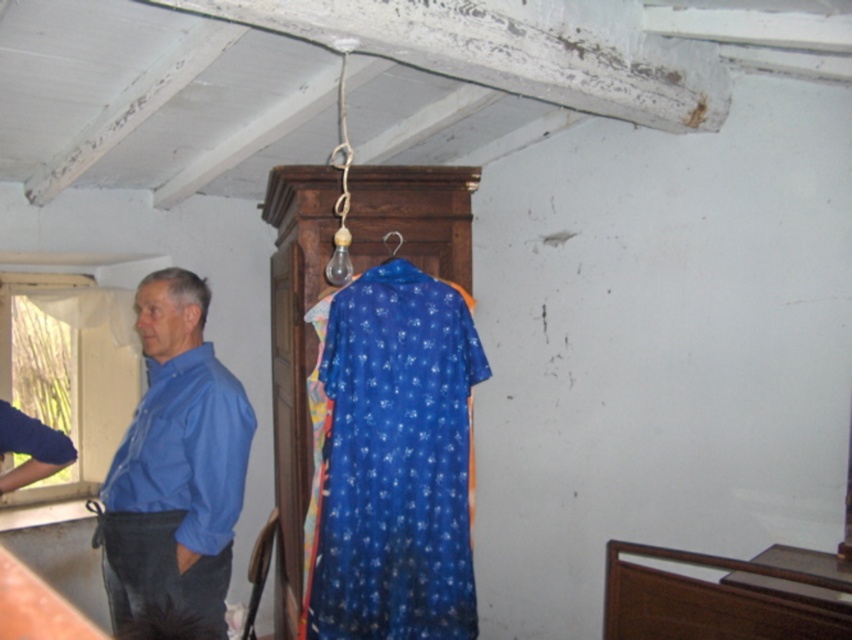
You are standing in the room and want to place a small decorative item on the surface between the two points labeled as point (x=381, y=385) and point (x=398, y=241). Which point should you choose to ensure the item is closer to you?

Point (x=381, y=385) is closer to the viewer than point (x=398, y=241), so placing the item there would make it closer to you.

You are standing in the room and want to hang your matte blue shirt at left on the metallic hook at center. Can you reach the hook from where the shirt is placed?

The matte blue shirt at left is to the left of the metallic hook at center, so yes, you can reach the hook from the shirt location since they are positioned next to each other horizontally.

You are organizing a small closet and need to place both the matte blue shirt at left and the metallic hook at center. Given their sizes, which item should you place first to ensure both fit properly?

The matte blue shirt at left is bigger than the metallic hook at center, so you should place the matte blue shirt at left first to accommodate its larger size before placing the metallic hook at center.